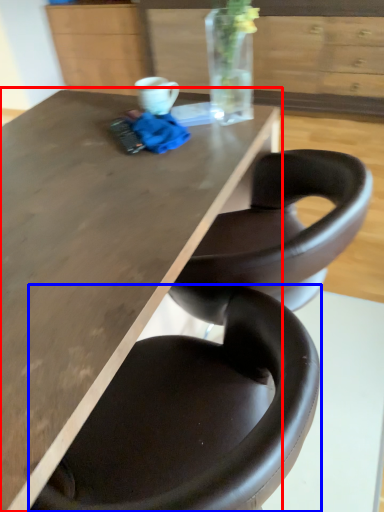
Question: Which object appears farthest to the camera in this image, table (highlighted by a red box) or chair (highlighted by a blue box)?

Choices:
 (A) table
 (B) chair

Answer: (A)